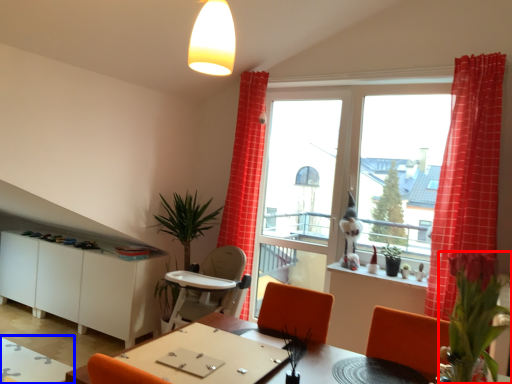
Question: Among these objects, which one is farthest to the camera, plant (highlighted by a red box) or table (highlighted by a blue box)?

Choices:
 (A) plant
 (B) table

Answer: (B)